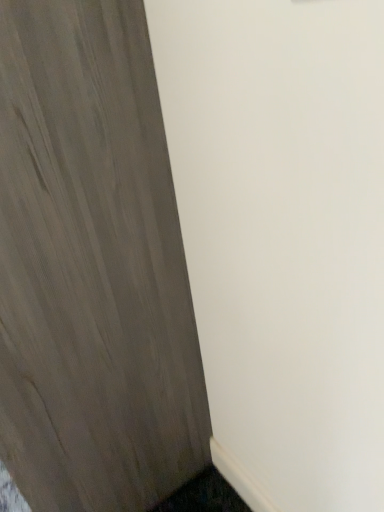
The height and width of the screenshot is (512, 384). Identify the location of matte wood door at left. (91, 267).

Describe the element at coordinates (91, 267) in the screenshot. This screenshot has width=384, height=512. I see `matte wood door at left` at that location.

The image size is (384, 512). Find the location of `matte wood door at left`. matte wood door at left is located at coordinates (91, 267).